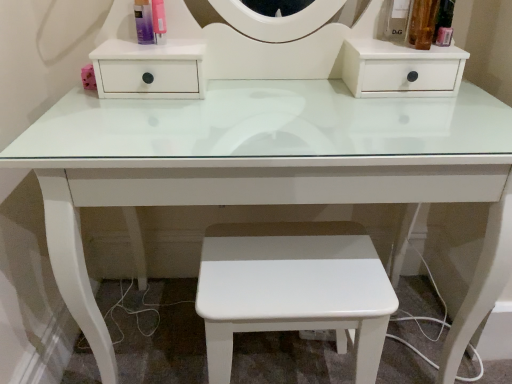
Question: Should I look upward or downward to see white glossy stool at center?

Choices:
 (A) up
 (B) down

Answer: (B)

Question: Is the depth of white glossy stool at center greater than that of matte plastic spray at upper left?

Choices:
 (A) yes
 (B) no

Answer: (B)

Question: Does white glossy stool at center lie in front of matte plastic spray at upper left?

Choices:
 (A) no
 (B) yes

Answer: (B)

Question: Is white glossy stool at center wider than matte plastic spray at upper left?

Choices:
 (A) yes
 (B) no

Answer: (A)

Question: Is matte plastic spray at upper left at the back of white glossy stool at center?

Choices:
 (A) no
 (B) yes

Answer: (A)

Question: Would you say white glossy stool at center is outside matte plastic spray at upper left?

Choices:
 (A) no
 (B) yes

Answer: (B)

Question: Would you say matte plastic spray at upper left is part of white glossy stool at center's contents?

Choices:
 (A) yes
 (B) no

Answer: (B)

Question: From the image's perspective, does matte plastic spray at upper left appear lower than white glossy stool at center?

Choices:
 (A) no
 (B) yes

Answer: (A)

Question: Is matte plastic spray at upper left positioned behind white glossy stool at center?

Choices:
 (A) no
 (B) yes

Answer: (B)

Question: Does matte plastic spray at upper left turn towards white glossy stool at center?

Choices:
 (A) no
 (B) yes

Answer: (A)

Question: Is there a large distance between matte plastic spray at upper left and white glossy stool at center?

Choices:
 (A) yes
 (B) no

Answer: (B)

Question: From a real-world perspective, is matte plastic spray at upper left positioned over white glossy stool at center based on gravity?

Choices:
 (A) no
 (B) yes

Answer: (B)

Question: Considering the relative positions of matte plastic spray at upper left and white glossy stool at center in the image provided, is matte plastic spray at upper left in front of white glossy stool at center?

Choices:
 (A) yes
 (B) no

Answer: (B)

Question: Is white glossy stool at center inside the boundaries of matte plastic spray at upper left, or outside?

Choices:
 (A) inside
 (B) outside

Answer: (B)